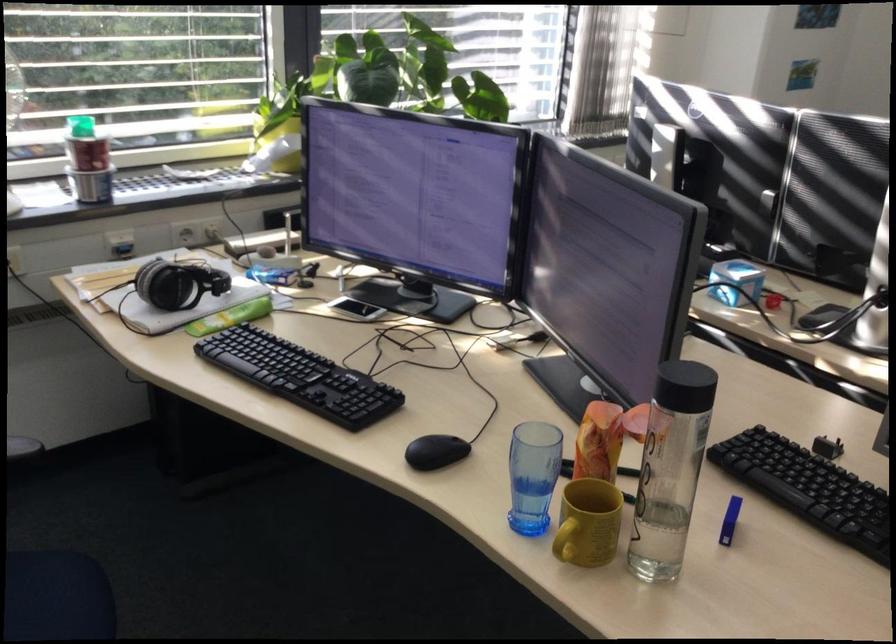
Where would you grasp the yellow mug handle? Please return your answer as a coordinate pair (x, y).

(564, 547)